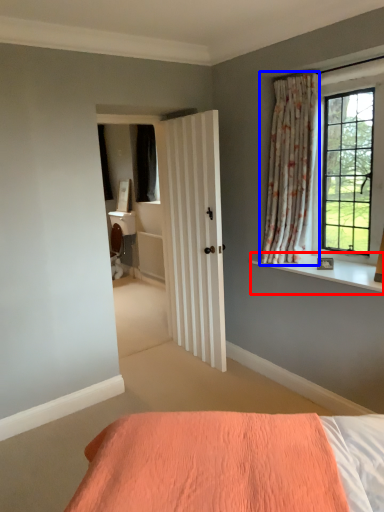
Question: Which object is further to the camera taking this photo, window sill (highlighted by a red box) or curtain (highlighted by a blue box)?

Choices:
 (A) window sill
 (B) curtain

Answer: (B)